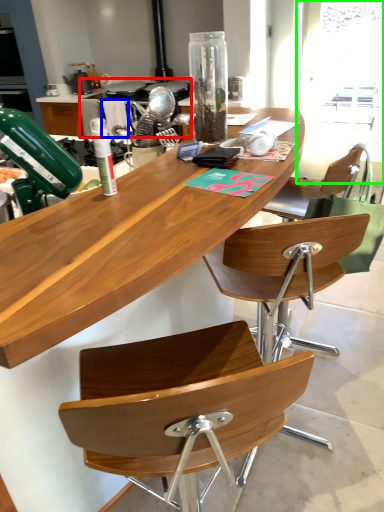
Question: Considering the real-world distances, which object is farthest from appliance (highlighted by a red box)? towel/napkin (highlighted by a blue box) or window screen (highlighted by a green box)?

Choices:
 (A) towel/napkin
 (B) window screen

Answer: (B)